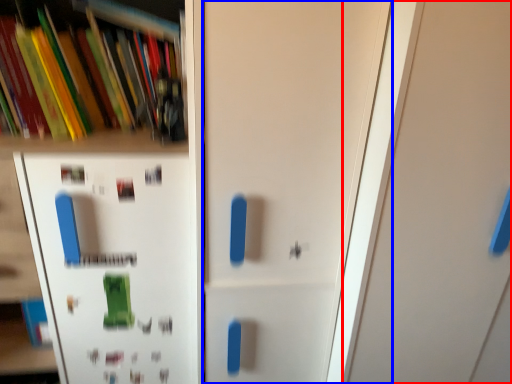
Question: Which point is further to the camera, door (highlighted by a red box) or door (highlighted by a blue box)?

Choices:
 (A) door
 (B) door

Answer: (B)